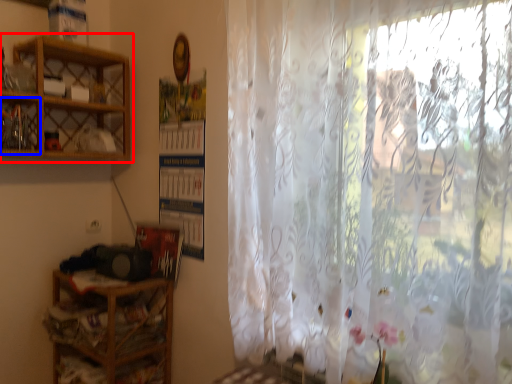
Question: Which of the following is the farthest to the observer, shelf (highlighted by a red box) or cabinet (highlighted by a blue box)?

Choices:
 (A) shelf
 (B) cabinet

Answer: (B)